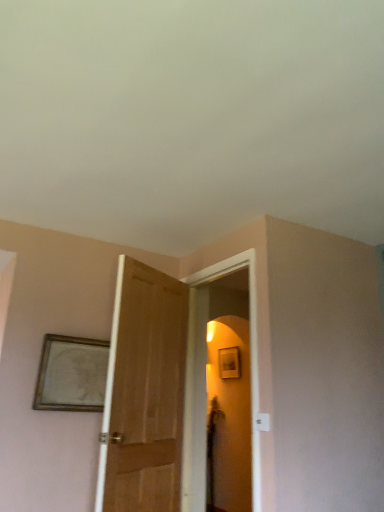
Question: Does wooden framed drawing at upper left turn towards matte wooden screen door at center?

Choices:
 (A) no
 (B) yes

Answer: (A)

Question: Is the surface of wooden framed drawing at upper left in direct contact with matte wooden screen door at center?

Choices:
 (A) yes
 (B) no

Answer: (B)

Question: Is matte wooden screen door at center at the back of wooden framed drawing at upper left?

Choices:
 (A) no
 (B) yes

Answer: (A)

Question: Is wooden framed drawing at upper left smaller than matte wooden screen door at center?

Choices:
 (A) no
 (B) yes

Answer: (B)

Question: Is wooden framed drawing at upper left at the left side of matte wooden screen door at center?

Choices:
 (A) no
 (B) yes

Answer: (B)

Question: Is wooden framed drawing at upper left thinner than matte wooden screen door at center?

Choices:
 (A) yes
 (B) no

Answer: (A)

Question: Considering the relative sizes of matte wooden screen door at center and wooden framed drawing at upper left in the image provided, is matte wooden screen door at center thinner than wooden framed drawing at upper left?

Choices:
 (A) no
 (B) yes

Answer: (A)

Question: Considering the relative sizes of matte wooden screen door at center and wooden framed drawing at upper left in the image provided, is matte wooden screen door at center taller than wooden framed drawing at upper left?

Choices:
 (A) yes
 (B) no

Answer: (A)

Question: Can you confirm if matte wooden screen door at center is positioned to the right of wooden framed drawing at upper left?

Choices:
 (A) yes
 (B) no

Answer: (A)

Question: Could you tell me if matte wooden screen door at center is facing wooden framed drawing at upper left?

Choices:
 (A) no
 (B) yes

Answer: (B)

Question: Is matte wooden screen door at center smaller than wooden framed drawing at upper left?

Choices:
 (A) no
 (B) yes

Answer: (A)

Question: Is matte wooden screen door at center further to camera compared to wooden framed drawing at upper left?

Choices:
 (A) yes
 (B) no

Answer: (B)

Question: Is point (104, 393) positioned closer to the camera than point (251, 503)?

Choices:
 (A) closer
 (B) farther

Answer: (B)